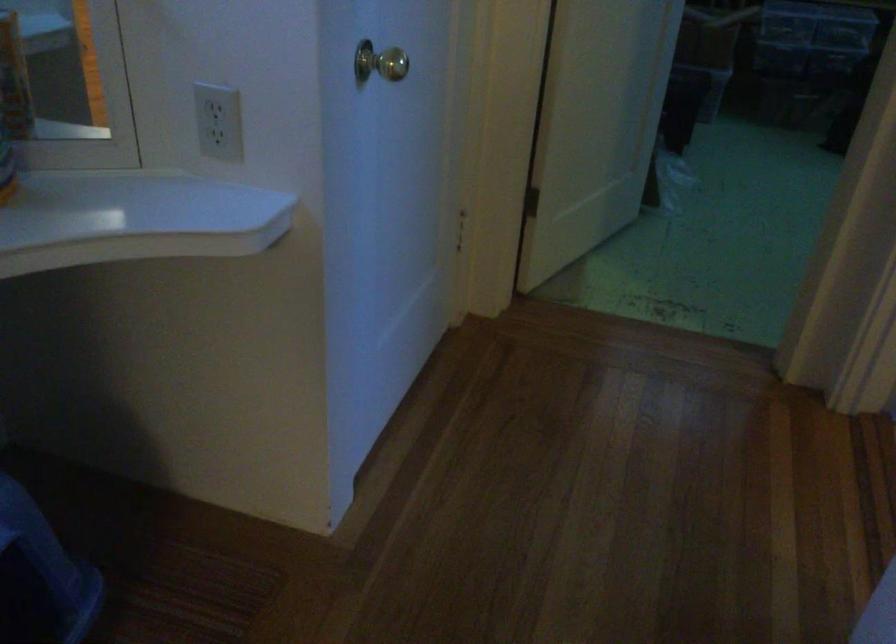
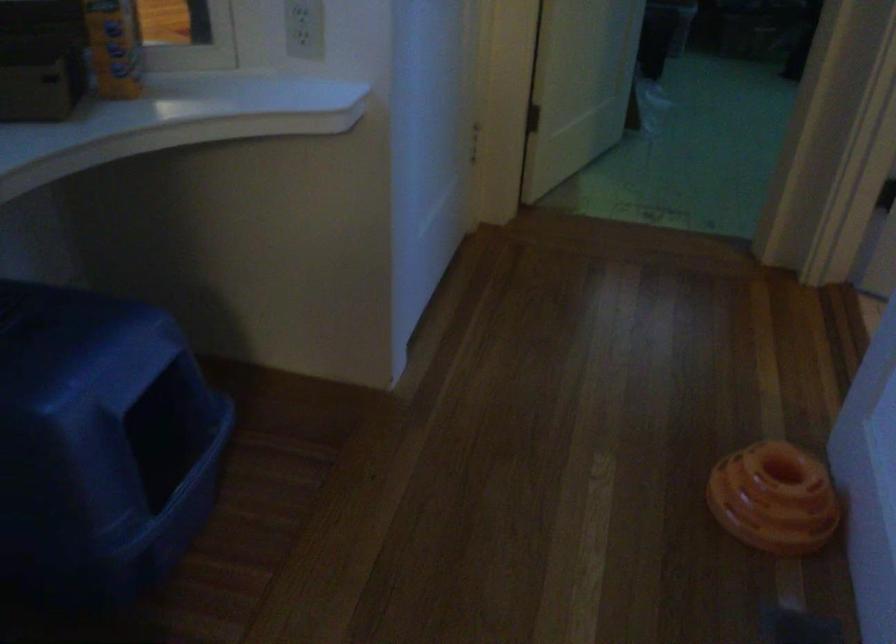
Which direction would the cameraman need to move to produce the second image?

The cameraman moved toward left, backward.